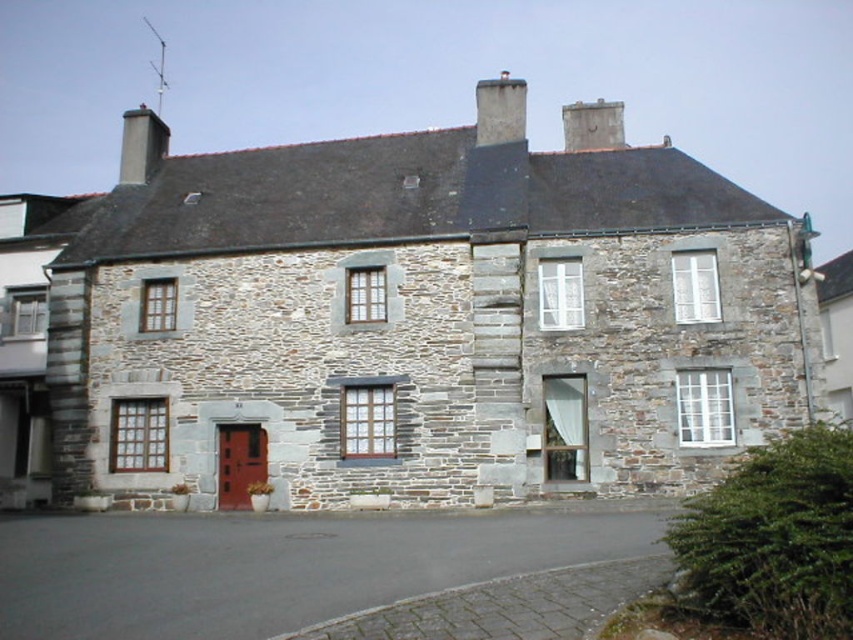
Question: Which object appears closest to the camera in this image?

Choices:
 (A) gray stone chimney at upper center
 (B) smooth gray chimney at upper left
 (C) smooth wooden door at center

Answer: (C)

Question: Does gray stone chimney at upper center have a greater width compared to smooth gray chimney at upper left?

Choices:
 (A) yes
 (B) no

Answer: (B)

Question: Does gray stone chimney at upper center have a lesser width compared to smooth stone chimney at upper center?

Choices:
 (A) no
 (B) yes

Answer: (B)

Question: Considering the real-world distances, which object is closest to the smooth stone chimney at upper center?

Choices:
 (A) smooth wooden door at center
 (B) gray stone chimney at upper center
 (C) smooth gray chimney at upper left

Answer: (B)

Question: Based on their relative distances, which object is nearer to the smooth stone chimney at upper center?

Choices:
 (A) smooth gray chimney at upper left
 (B) smooth wooden door at center
 (C) gray stone chimney at upper center

Answer: (C)

Question: Does smooth gray chimney at upper left have a smaller size compared to smooth stone chimney at upper center?

Choices:
 (A) no
 (B) yes

Answer: (A)